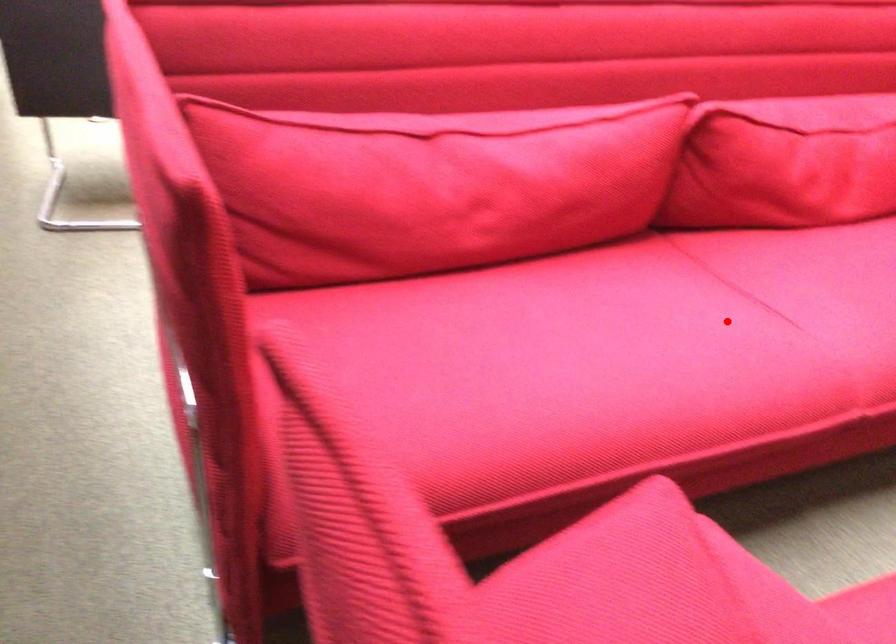
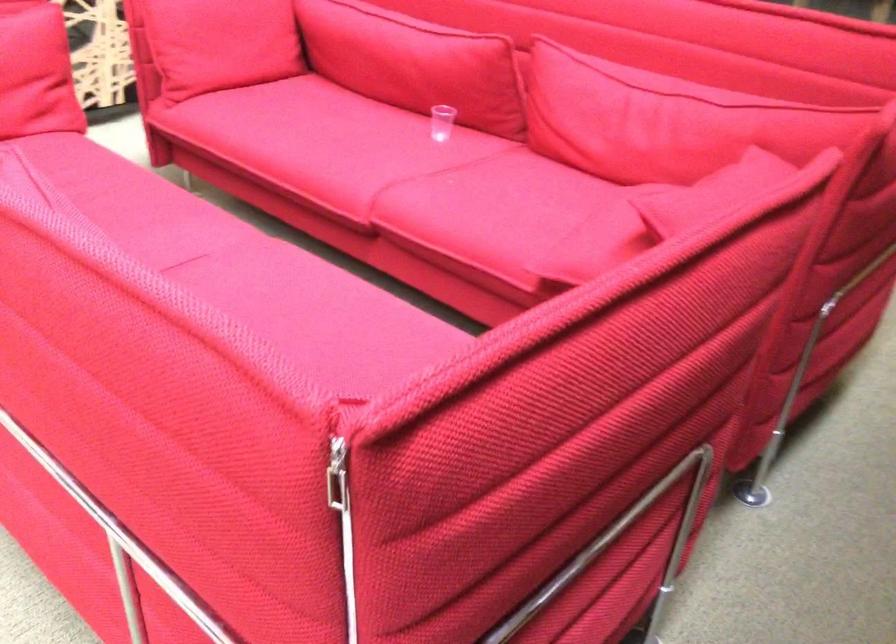
Question: I am providing you with two images of the same scene from different viewpoints. A red point is marked on the first image. Can you still see the location of the red point in image 2?

Choices:
 (A) Yes
 (B) No

Answer: (A)